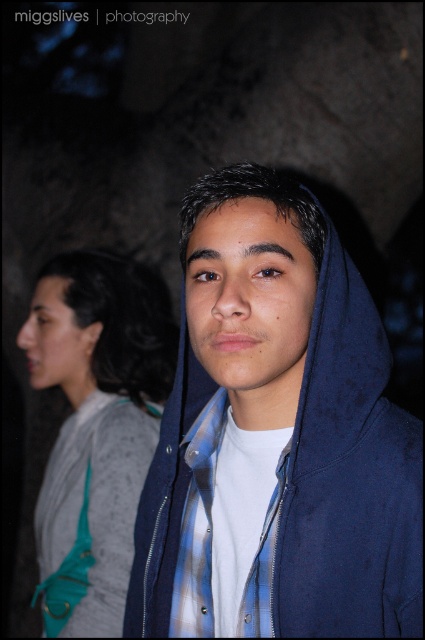
Question: Is blue velvety hoodie at center to the left of blue plaid shirt at center from the viewer's perspective?

Choices:
 (A) yes
 (B) no

Answer: (B)

Question: Is teal fabric purse at left wider than blue plaid shirt at center?

Choices:
 (A) no
 (B) yes

Answer: (B)

Question: Which of these objects is positioned farthest from the blue plaid shirt at center?

Choices:
 (A) blue velvety hoodie at center
 (B) teal fabric purse at left

Answer: (B)

Question: Can you confirm if blue velvety hoodie at center is wider than teal fabric purse at left?

Choices:
 (A) yes
 (B) no

Answer: (A)

Question: Which object is positioned farthest from the blue plaid shirt at center?

Choices:
 (A) teal fabric purse at left
 (B) blue velvety hoodie at center

Answer: (A)

Question: Considering the real-world distances, which object is farthest from the teal fabric purse at left?

Choices:
 (A) blue velvety hoodie at center
 (B) blue plaid shirt at center

Answer: (B)